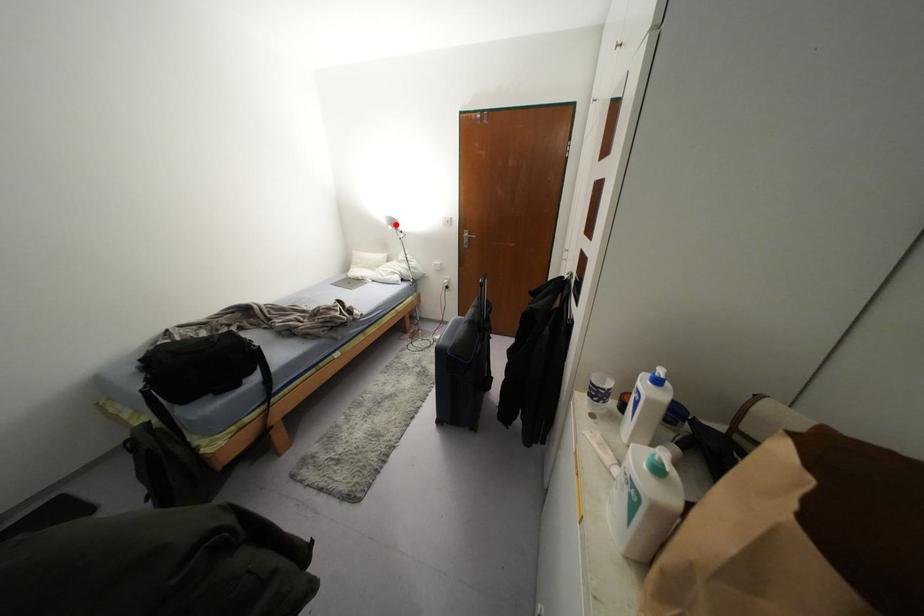
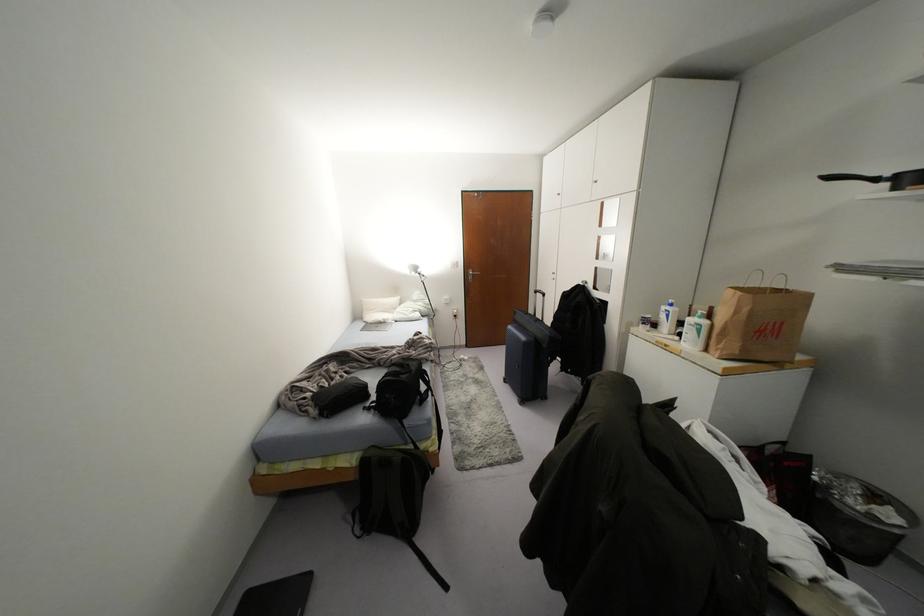
The point at the highlighted location is marked in the first image. Where is the corresponding point in the second image?

(419, 270)